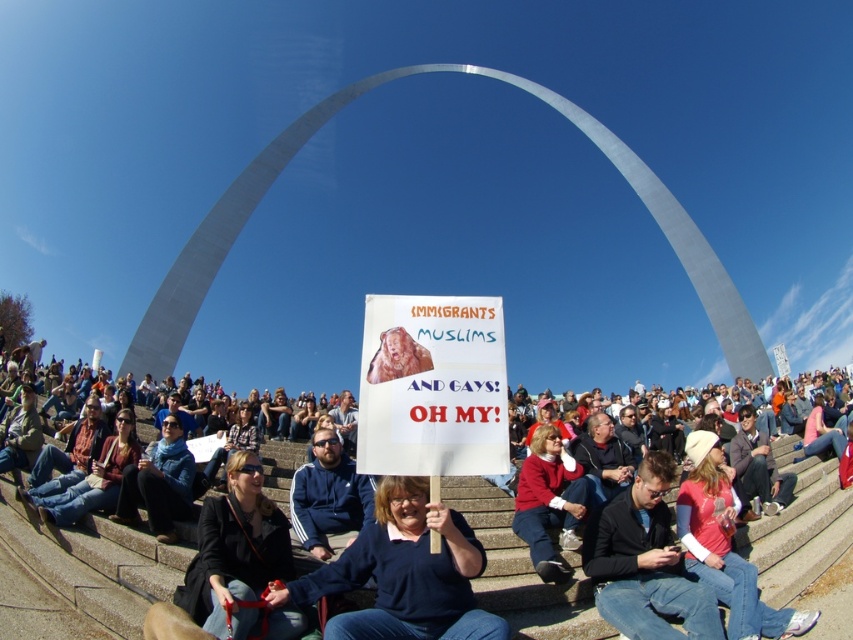
You are a photographer trying to capture a photo of the red sweater at center without the dark brown leather jacket at center blocking it. What should you do?

Move your position to the side so the red sweater at center is no longer behind the dark brown leather jacket at center.

You are at the event and want to see the sign held by the person at the front. Are you currently standing behind the blue sweater at center or the red sweater at lower right?

You are standing behind the red sweater at lower right because the blue sweater at center is in front of it, blocking your view.